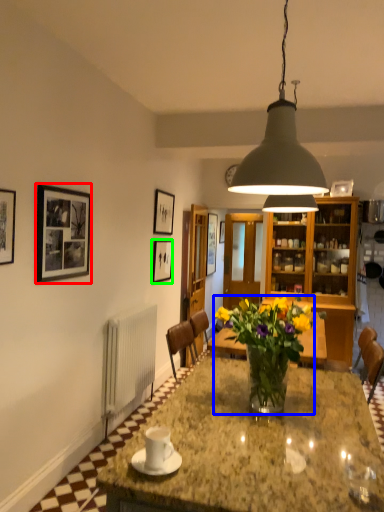
Question: Considering the real-world distances, which object is closest to picture frame (highlighted by a red box)? houseplant (highlighted by a blue box) or picture frame (highlighted by a green box).

Choices:
 (A) houseplant
 (B) picture frame

Answer: (A)